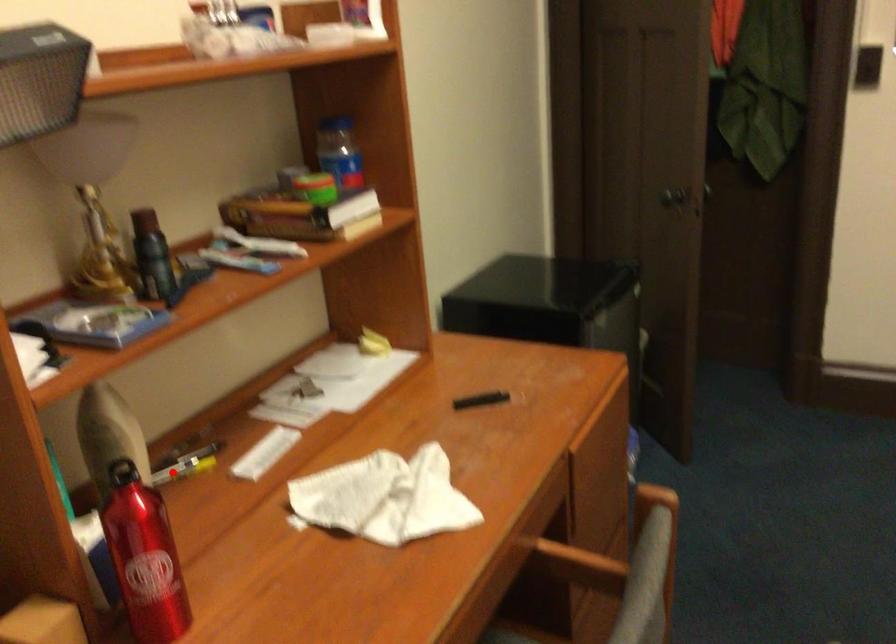
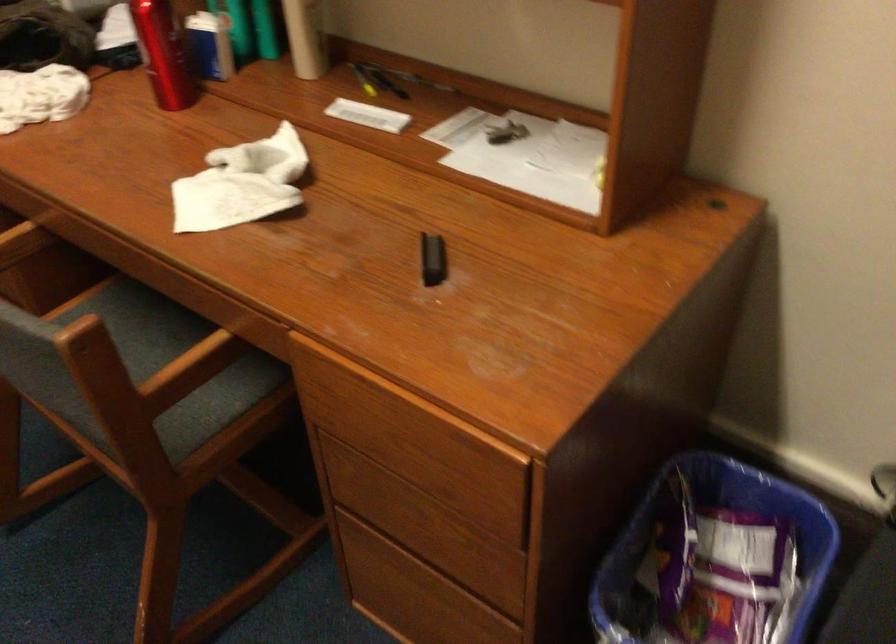
Find the pixel in the second image that matches the highlighted location in the first image.

(363, 80)